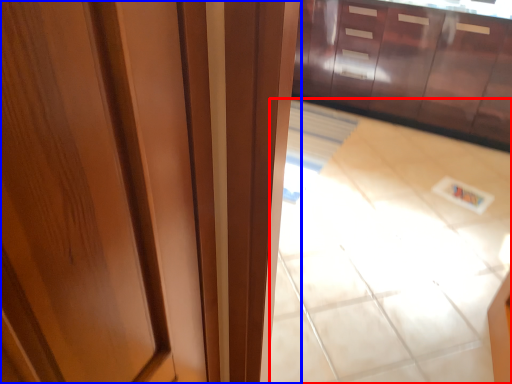
Question: Which of the following is the farthest to the observer, tile (highlighted by a red box) or door (highlighted by a blue box)?

Choices:
 (A) tile
 (B) door

Answer: (A)